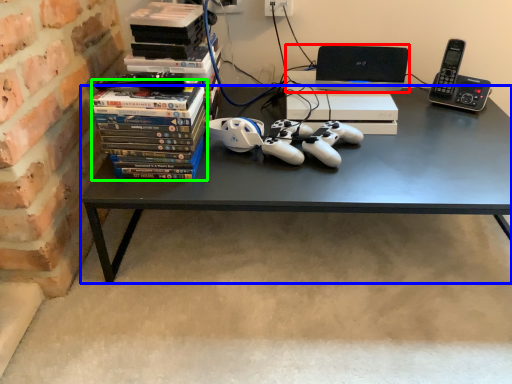
Question: Which object is the farthest from computer (highlighted by a red box)? Choose among these: desk (highlighted by a blue box) or book (highlighted by a green box).

Choices:
 (A) desk
 (B) book

Answer: (B)